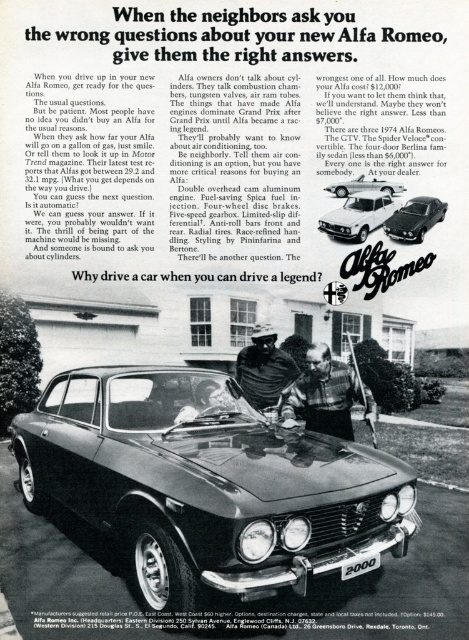
Can you confirm if metallic silver sedan at center is positioned above white glossy sedan at center?

Incorrect, metallic silver sedan at center is not positioned above white glossy sedan at center.

What do you see at coordinates (207, 484) in the screenshot?
I see `metallic silver sedan at center` at bounding box center [207, 484].

This screenshot has height=640, width=469. Identify the location of metallic silver sedan at center. (207, 484).

Who is lower down, dark blue leather jacket at center or shiny silver sedan at center?

dark blue leather jacket at center is below.

Does dark blue leather jacket at center come behind shiny silver sedan at center?

Yes, it is.

What do you see at coordinates (264, 371) in the screenshot? I see `dark blue leather jacket at center` at bounding box center [264, 371].

You are a GUI agent. You are given a task and a screenshot of the screen. Output one action in this format:
    pyautogui.click(x=<x>, y=<y>)
    Task: Click on the dark blue leather jacket at center
    
    Given the screenshot: What is the action you would take?
    pyautogui.click(x=264, y=371)

Is dark blue leather jacket at center thinner than white glossy sedan at center?

Incorrect, dark blue leather jacket at center's width is not less than white glossy sedan at center's.

Is dark blue leather jacket at center above white glossy sedan at center?

No.

Is point (250, 372) farther from camera compared to point (349, 212)?

Yes.

Locate an element on the screen. dark blue leather jacket at center is located at coordinates (264, 371).